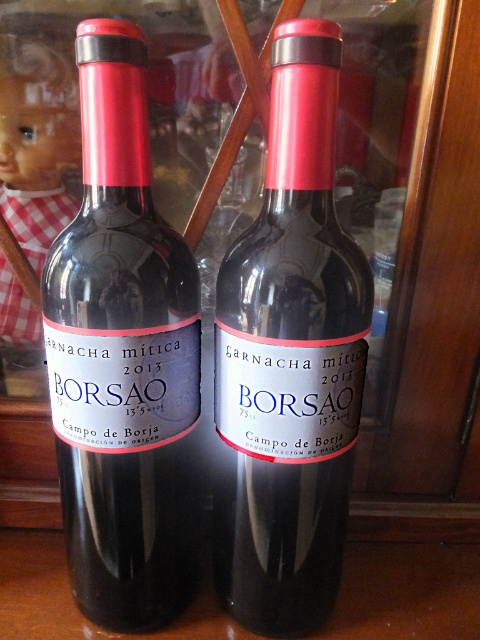
You are organizing a wine display and need to place a new bottle between the matte black bottle at left and the matte glass wine bottle at center. Based on their positions, where should the new bottle be placed?

The new bottle should be placed between the matte black bottle at left and the matte glass wine bottle at center, as the matte black bottle at left is positioned to the left of the matte glass wine bottle at center.

You are a wine connoisseur standing in front of the two BORSAO wine bottles. You notice two points marked in the scene. Which point, point [117,467] or point [276,573], is closer to you?

Point [117,467] is closer to the viewer than point [276,573].